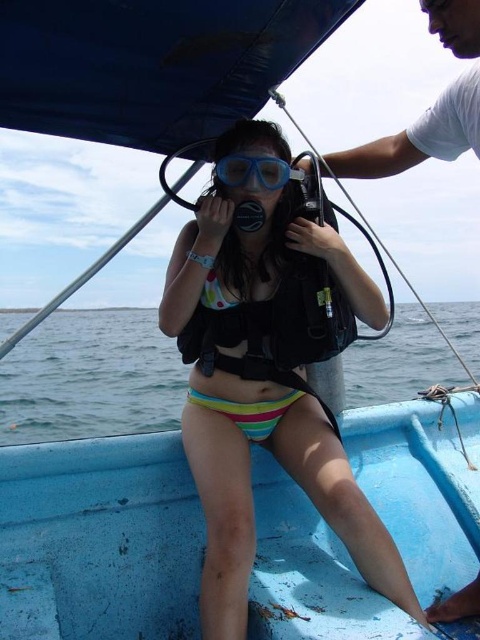
You are a photographer trying to capture the diver in the blue boat. You notice a point at coordinates (x=419, y=136). What object is located at that point?

The point at coordinates (x=419, y=136) indicates a white cotton shirt at upper right.

You are a diver preparing to jump into the water. You notice the white cotton shirt at upper right and the blue matte scuba mask at center. Which item is covering the other one?

The white cotton shirt at upper right is positioned over the blue matte scuba mask at center, so it is covering it.

You are a photographer trying to capture a clear shot of the multicolored bikini at center and the blue matte scuba mask at center. Which object should you focus on first to ensure both are in focus?

The multicolored bikini at center is closer to the viewer than the blue matte scuba mask at center, so focus on the multicolored bikini at center first to ensure both are in focus.